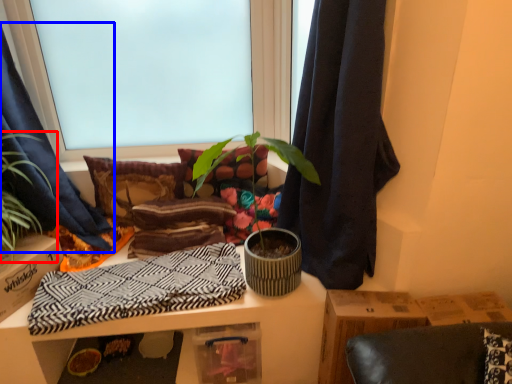
Question: Which object is further to the camera taking this photo, houseplant (highlighted by a red box) or curtain (highlighted by a blue box)?

Choices:
 (A) houseplant
 (B) curtain

Answer: (A)